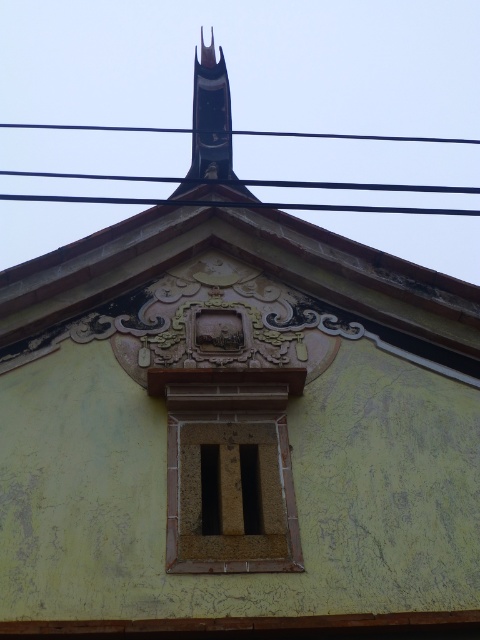
Between brown textured stone window at center and black wire at upper center, which one is positioned higher?

Positioned higher is black wire at upper center.

Who is shorter, brown textured stone window at center or black wire at upper center?

With less height is brown textured stone window at center.

Which is behind, point (182, 515) or point (2, 196)?

Point (2, 196)

Where is `brown textured stone window at center`? This screenshot has height=640, width=480. brown textured stone window at center is located at coordinates (229, 468).